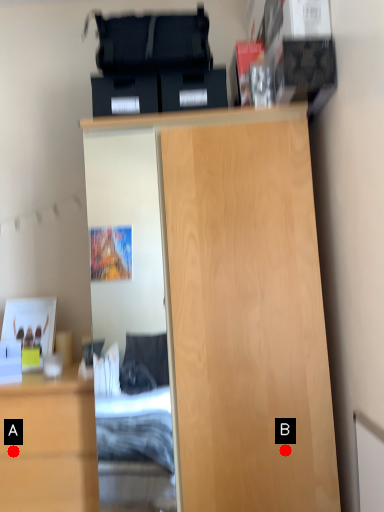
Question: Two points are circled on the image, labeled by A and B beside each circle. Which of the following is the farthest from the observer?

Choices:
 (A) A is further
 (B) B is further

Answer: (A)